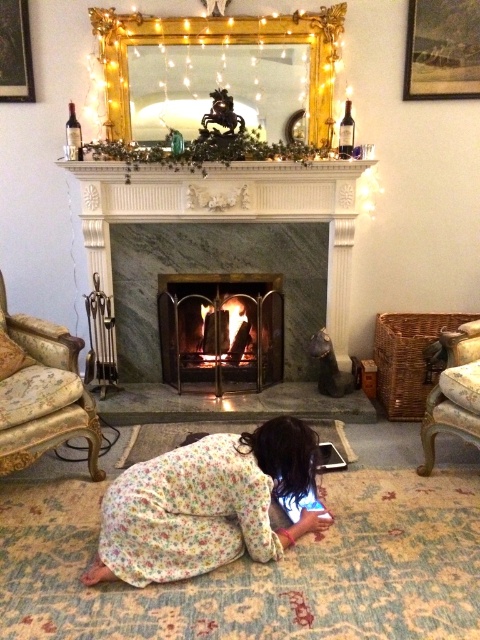
Question: Which point is farther to the camera?

Choices:
 (A) wooden picture frame at upper right
 (B) floral cotton dress at lower center
 (C) wooden picture frame at upper left

Answer: (A)

Question: Which object is farther from the camera taking this photo?

Choices:
 (A) gold-patterned armchair at left
 (B) gold metal fireplace at center
 (C) marble fireplace at center
 (D) wooden picture frame at upper right

Answer: (B)

Question: Where is gold metal fireplace at center located in relation to wooden picture frame at upper right in the image?

Choices:
 (A) below
 (B) above

Answer: (A)

Question: From the image, what is the correct spatial relationship of marble fireplace at center in relation to wooden armchair at lower right?

Choices:
 (A) left
 (B) right

Answer: (A)

Question: In this image, where is marble fireplace at center located relative to wooden armchair at lower right?

Choices:
 (A) above
 (B) below

Answer: (A)

Question: Which point appears farthest from the camera in this image?

Choices:
 (A) (200, 307)
 (B) (24, 68)
 (C) (214, 477)

Answer: (A)